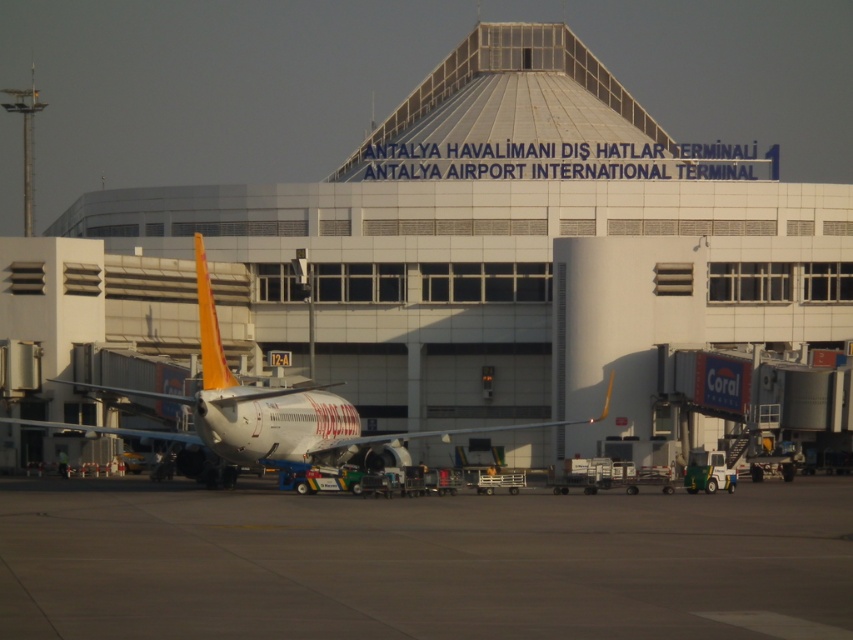
Who is positioned more to the right, white concrete building at center or white glossy airplane at center?

From the viewer's perspective, white glossy airplane at center appears more on the right side.

Does white concrete building at center have a larger size compared to white glossy airplane at center?

Yes, white concrete building at center is bigger than white glossy airplane at center.

I want to click on white concrete building at center, so click(x=488, y=269).

This screenshot has height=640, width=853. I want to click on white concrete building at center, so click(488, 269).

Is white concrete building at center taller than gray concrete tarmac at lower center?

Yes, white concrete building at center is taller than gray concrete tarmac at lower center.

What are the coordinates of `white concrete building at center` in the screenshot? It's located at (488, 269).

Measure the distance between white concrete building at center and camera.

57.64 meters

At what (x,y) coordinates should I click in order to perform the action: click on white concrete building at center. Please return your answer as a coordinate pair (x, y). The image size is (853, 640). Looking at the image, I should click on (488, 269).

Which is more to the right, gray concrete tarmac at lower center or white glossy airplane at center?

Positioned to the right is gray concrete tarmac at lower center.

Is point (844, 589) positioned after point (202, 284)?

No, it is in front of (202, 284).

Find the location of `gray concrete tarmac at lower center`. gray concrete tarmac at lower center is located at coordinates (422, 563).